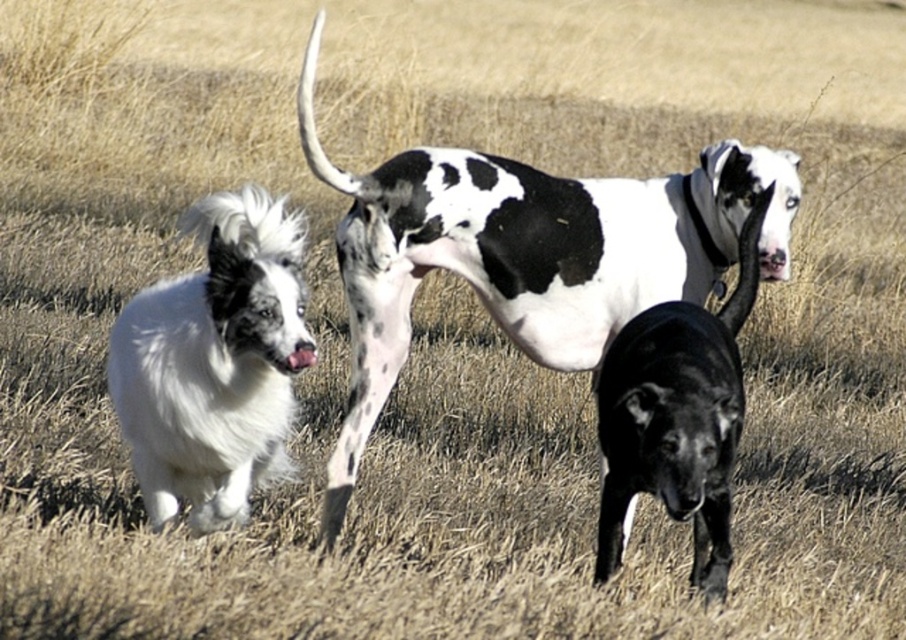
Question: Which of the following is the closest to the observer?

Choices:
 (A) black and white spotted coat at center
 (B) black glossy dog at center
 (C) white fluffy dog at left

Answer: (B)

Question: Estimate the real-world distances between objects in this image. Which object is closer to the white fluffy dog at left?

Choices:
 (A) black glossy dog at center
 (B) black and white spotted coat at center

Answer: (B)

Question: Is black and white spotted coat at center wider than black glossy dog at center?

Choices:
 (A) yes
 (B) no

Answer: (A)

Question: Among these objects, which one is nearest to the camera?

Choices:
 (A) white fluffy dog at left
 (B) black and white spotted coat at center
 (C) black glossy dog at center

Answer: (C)

Question: Is black and white spotted coat at center smaller than black glossy dog at center?

Choices:
 (A) yes
 (B) no

Answer: (B)

Question: Is black and white spotted coat at center to the left of white fluffy dog at left from the viewer's perspective?

Choices:
 (A) yes
 (B) no

Answer: (B)